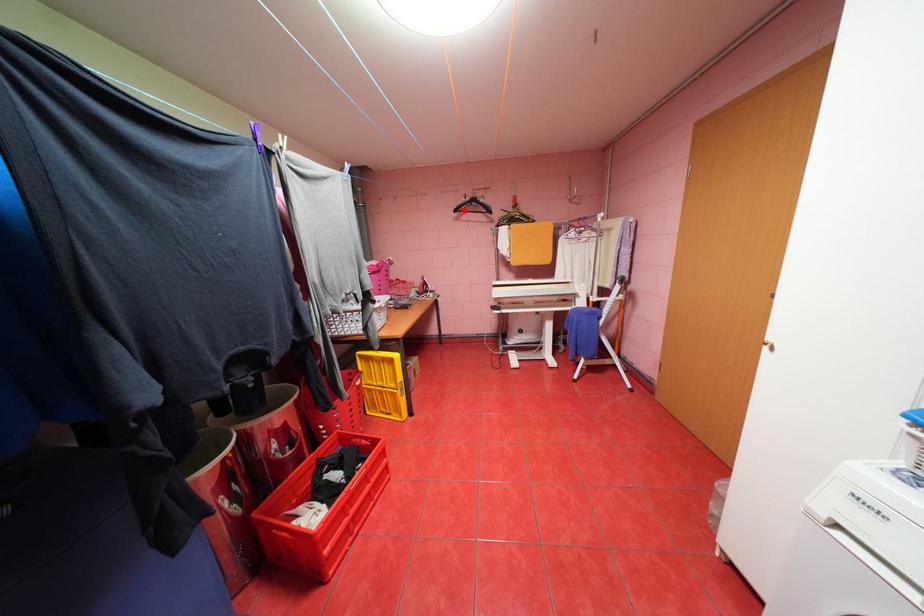
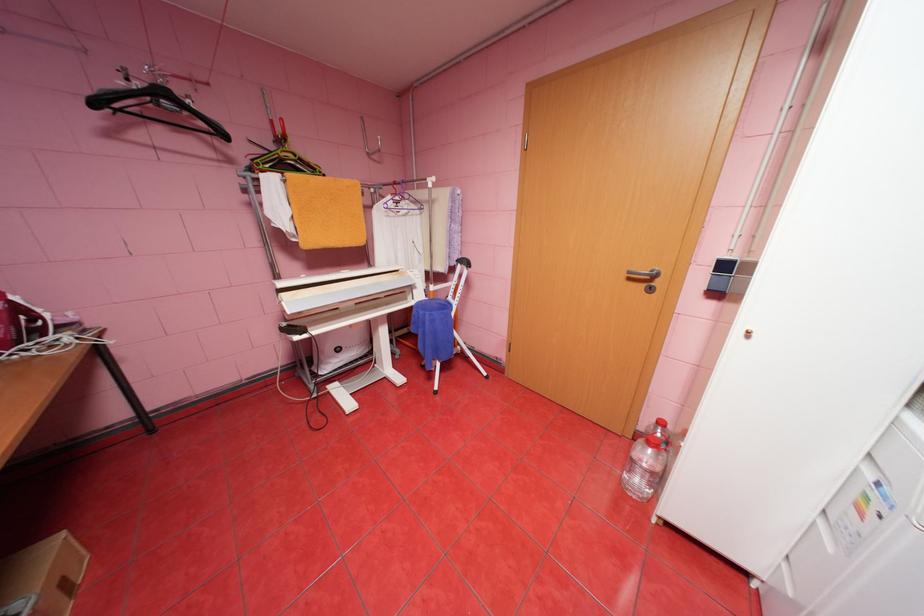
Question: A red point is marked in image1. In image2, is the corresponding 3D point closer to the camera or farther? Reply with the corresponding letter.

Choices:
 (A) The corresponding 3D point is closer.
 (B) The corresponding 3D point is farther.

Answer: (B)